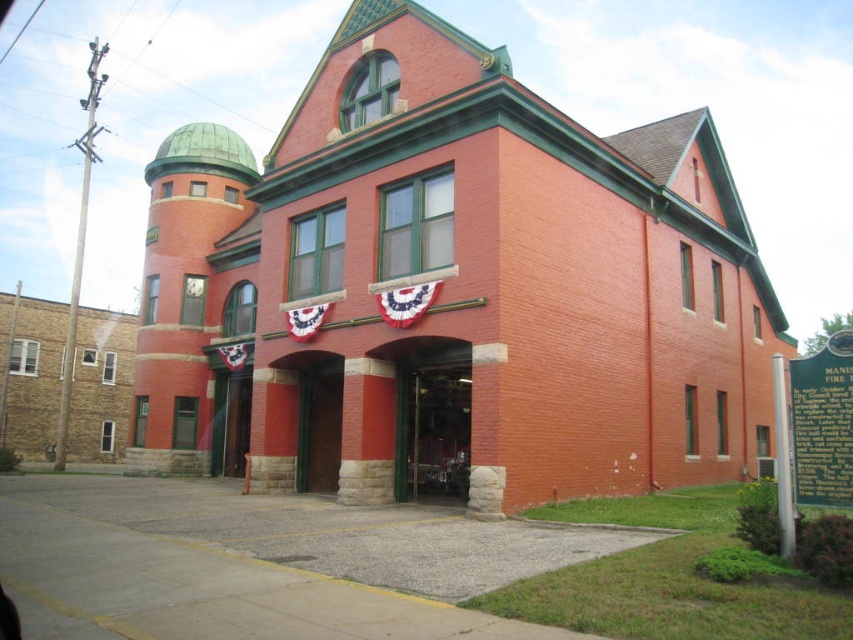
Measure the distance between point (402, 378) and camera.

44.08 meters

Is metallic glass door at center closer to the viewer compared to green wooden door at center?

Yes, it is.

Describe the element at coordinates (433, 429) in the screenshot. The height and width of the screenshot is (640, 853). I see `metallic glass door at center` at that location.

Where is `metallic glass door at center`? This screenshot has width=853, height=640. metallic glass door at center is located at coordinates [433, 429].